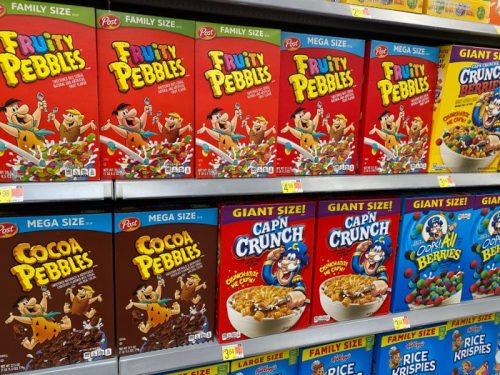
Locate an element on the screen. The image size is (500, 375). boxes that are mainly blue is located at coordinates (442, 261), (492, 248), (478, 335), (419, 354), (350, 349), (270, 369).